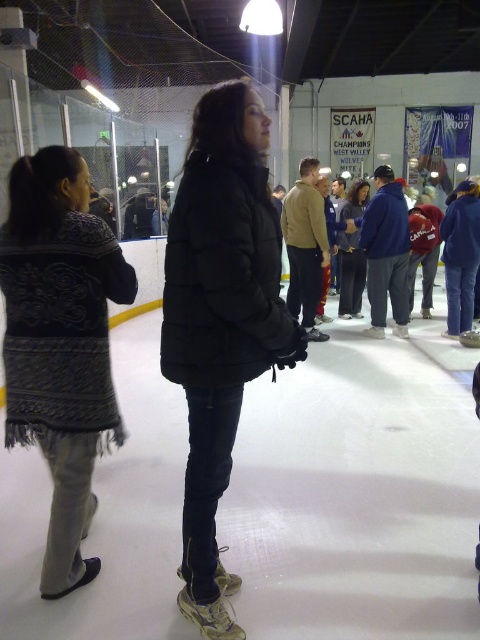
Does dark gray knitted sweater at left have a lesser width compared to matte black jacket at center?

No.

Who is higher up, dark gray knitted sweater at left or matte black jacket at center?

matte black jacket at center is above.

Locate an element on the screen. The width and height of the screenshot is (480, 640). dark gray knitted sweater at left is located at coordinates [x=60, y=342].

Does black puffer jacket at center have a lesser width compared to matte black jacket at center?

In fact, black puffer jacket at center might be wider than matte black jacket at center.

Which is in front, point (249, 298) or point (360, 220)?

Point (249, 298) is in front.

Locate an element on the screen. The width and height of the screenshot is (480, 640). black puffer jacket at center is located at coordinates (220, 321).

Which is more to the left, black puffer jacket at center or dark gray knitted sweater at left?

dark gray knitted sweater at left

This screenshot has width=480, height=640. What do you see at coordinates (220, 321) in the screenshot?
I see `black puffer jacket at center` at bounding box center [220, 321].

Where is `black puffer jacket at center`? This screenshot has width=480, height=640. black puffer jacket at center is located at coordinates (220, 321).